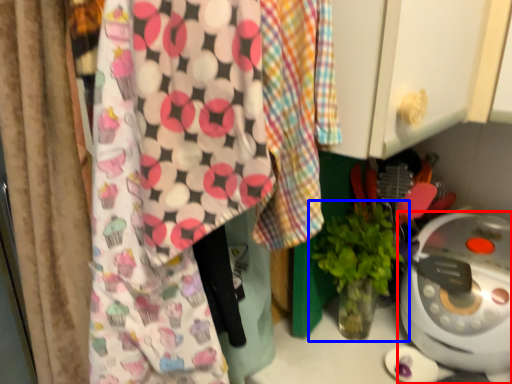
Question: Which of the following is the closest to the observer, home appliance (highlighted by a red box) or houseplant (highlighted by a blue box)?

Choices:
 (A) home appliance
 (B) houseplant

Answer: (A)